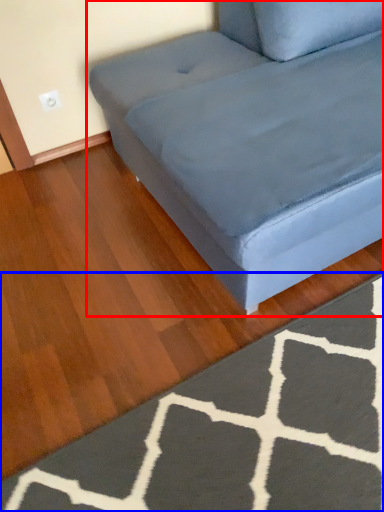
Question: Which of the following is the farthest to the observer, studio couch (highlighted by a red box) or doormat (highlighted by a blue box)?

Choices:
 (A) studio couch
 (B) doormat

Answer: (B)